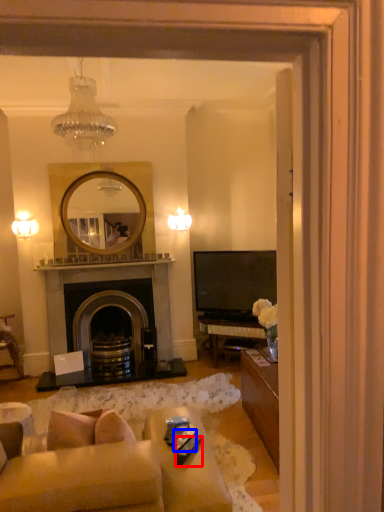
Question: Among these objects, which one is farthest to the camera, remote control (highlighted by a red box) or remote control (highlighted by a blue box)?

Choices:
 (A) remote control
 (B) remote control

Answer: (B)